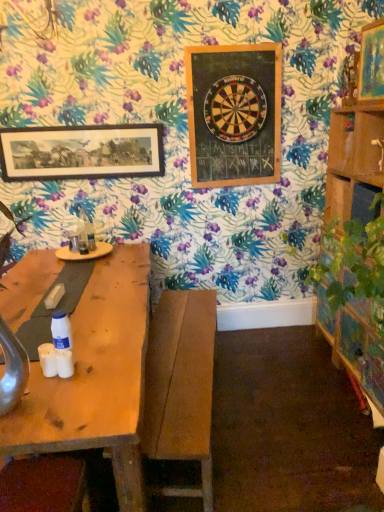
You are a GUI agent. You are given a task and a screenshot of the screen. Output one action in this format:
    pyautogui.click(x=<x>, y=<y>)
    Task: Click on the wooden picture frame at upper right, positioned as the first picture frame in front-to-back order
    This screenshot has width=384, height=512.
    Given the screenshot: What is the action you would take?
    pyautogui.click(x=372, y=62)

Can you confirm if velvet brown cushion at lower left, the first swivel chair positioned from the front, is wider than wooden dartboard at upper center, the second picture frame in the front-to-back sequence?

Indeed, velvet brown cushion at lower left, the first swivel chair positioned from the front, has a greater width compared to wooden dartboard at upper center, the second picture frame in the front-to-back sequence.

In the scene shown: Is velvet brown cushion at lower left, which appears as the first swivel chair when viewed from the left, positioned with its back to wooden dartboard at upper center, positioned as the second picture frame in back-to-front order?

No, wooden dartboard at upper center, positioned as the second picture frame in back-to-front order, is not at the back of velvet brown cushion at lower left, which appears as the first swivel chair when viewed from the left.

There is a velvet brown cushion at lower left, which appears as the first swivel chair when viewed from the left. Where is `the 2nd picture frame above it (from a real-world perspective)`? the 2nd picture frame above it (from a real-world perspective) is located at coordinates (234, 114).

Consider the image. Is the depth of velvet brown cushion at lower left, placed as the 2th swivel chair when sorted from right to left, greater than that of wooden dartboard at upper center, the second picture frame in the front-to-back sequence?

No, velvet brown cushion at lower left, placed as the 2th swivel chair when sorted from right to left, is in front of wooden dartboard at upper center, the second picture frame in the front-to-back sequence.

From a real-world perspective, which picture frame is the 3rd one above the velvet brown cushion at lower left, the first swivel chair positioned from the front? Please provide its 2D coordinates.

[(372, 62)]

From the picture: Considering the sizes of objects velvet brown cushion at lower left, placed as the 2th swivel chair when sorted from right to left, and wooden picture frame at upper right, positioned as the first picture frame in front-to-back order, in the image provided, who is shorter, velvet brown cushion at lower left, placed as the 2th swivel chair when sorted from right to left, or wooden picture frame at upper right, positioned as the first picture frame in front-to-back order,?

velvet brown cushion at lower left, placed as the 2th swivel chair when sorted from right to left.

Is velvet brown cushion at lower left, which ranks as the 2th swivel chair in back-to-front order, aimed at wooden picture frame at upper right, the 3th picture frame when ordered from back to front?

No, velvet brown cushion at lower left, which ranks as the 2th swivel chair in back-to-front order, is not turned towards wooden picture frame at upper right, the 3th picture frame when ordered from back to front.

From a real-world perspective, is wooden bench at center, the second swivel chair from the left, positioned above or below wooden framed print at upper left, the 3th picture frame when ordered from front to back?

In terms of real-world spatial position, wooden bench at center, the second swivel chair from the left, is below wooden framed print at upper left, the 3th picture frame when ordered from front to back.

Who is smaller, wooden bench at center, which is the 2th swivel chair in front-to-back order, or wooden framed print at upper left, the 3th picture frame when ordered from front to back?

wooden framed print at upper left, the 3th picture frame when ordered from front to back.

Is wooden framed print at upper left, which is the third picture frame from right to left, at the back of wooden bench at center, which is the 2th swivel chair in front-to-back order?

No, wooden bench at center, which is the 2th swivel chair in front-to-back order, is not facing the opposite direction of wooden framed print at upper left, which is the third picture frame from right to left.

What's the angular difference between wooden bench at center, placed as the first swivel chair when sorted from back to front, and wooden framed print at upper left, marked as the 1th picture frame in a back-to-front arrangement,'s facing directions?

They differ by 99.7 degrees in their facing directions.

Which object is positioned more to the left, wooden framed print at upper left, the 3th picture frame when ordered from front to back, or velvet brown cushion at lower left, the first swivel chair positioned from the front?

wooden framed print at upper left, the 3th picture frame when ordered from front to back.

Which of these two, wooden framed print at upper left, marked as the 1th picture frame in a back-to-front arrangement, or velvet brown cushion at lower left, placed as the 2th swivel chair when sorted from right to left, stands shorter?

Standing shorter between the two is velvet brown cushion at lower left, placed as the 2th swivel chair when sorted from right to left.

From the image's perspective, who appears lower, wooden framed print at upper left, marked as the 1th picture frame in a back-to-front arrangement, or velvet brown cushion at lower left, the first swivel chair positioned from the front?

velvet brown cushion at lower left, the first swivel chair positioned from the front, from the image's perspective.

I want to click on the 2nd swivel chair in front of the wooden framed print at upper left, which is the third picture frame from right to left, starting your count from the anchor, so click(x=43, y=485).

Is the position of wooden picture frame at upper right, the 3th picture frame when ordered from back to front, less distant than that of wooden framed print at upper left, the 1th picture frame when ordered from left to right?

Yes.

From a real-world perspective, which object stands above the other?

wooden picture frame at upper right, arranged as the third picture frame when viewed from the left.

Between wooden picture frame at upper right, arranged as the 1th picture frame when viewed from the right, and wooden framed print at upper left, which is the third picture frame from right to left, which one has larger size?

wooden picture frame at upper right, arranged as the 1th picture frame when viewed from the right, is bigger.

Can you confirm if wooden framed print at upper left, the 1th picture frame when ordered from left to right, is shorter than wooden bench at center, the second swivel chair from the left?

Yes.

Is wooden framed print at upper left, the 1th picture frame when ordered from left to right, facing away from wooden bench at center, placed as the first swivel chair when sorted from back to front?

No, wooden bench at center, placed as the first swivel chair when sorted from back to front, is not at the back of wooden framed print at upper left, the 1th picture frame when ordered from left to right.

How different are the orientations of wooden framed print at upper left, marked as the 1th picture frame in a back-to-front arrangement, and wooden bench at center, placed as the first swivel chair when sorted from back to front, in degrees?

They differ by 99.7 degrees in their facing directions.

Considering the sizes of objects wooden framed print at upper left, the 3th picture frame when ordered from front to back, and wooden bench at center, placed as the first swivel chair when sorted from back to front, in the image provided, who is smaller, wooden framed print at upper left, the 3th picture frame when ordered from front to back, or wooden bench at center, placed as the first swivel chair when sorted from back to front,?

wooden framed print at upper left, the 3th picture frame when ordered from front to back, is smaller.

Considering the relative sizes of wooden dartboard at upper center, positioned as the second picture frame in back-to-front order, and wooden picture frame at upper right, arranged as the third picture frame when viewed from the left, in the image provided, is wooden dartboard at upper center, positioned as the second picture frame in back-to-front order, thinner than wooden picture frame at upper right, arranged as the third picture frame when viewed from the left,?

Indeed, wooden dartboard at upper center, positioned as the second picture frame in back-to-front order, has a lesser width compared to wooden picture frame at upper right, arranged as the third picture frame when viewed from the left.

From their relative heights in the image, would you say wooden dartboard at upper center, positioned as the second picture frame in back-to-front order, is taller or shorter than wooden picture frame at upper right, the 3th picture frame when ordered from back to front?

Considering their sizes, wooden dartboard at upper center, positioned as the second picture frame in back-to-front order, has more height than wooden picture frame at upper right, the 3th picture frame when ordered from back to front.

Visually, is wooden dartboard at upper center, the 2th picture frame when ordered from right to left, positioned to the left or to the right of wooden picture frame at upper right, arranged as the third picture frame when viewed from the left?

Based on their positions, wooden dartboard at upper center, the 2th picture frame when ordered from right to left, is located to the left of wooden picture frame at upper right, arranged as the third picture frame when viewed from the left.

Does wooden dartboard at upper center, positioned as the second picture frame in back-to-front order, touch wooden picture frame at upper right, the 3th picture frame when ordered from back to front?

No, wooden dartboard at upper center, positioned as the second picture frame in back-to-front order, is not with wooden picture frame at upper right, the 3th picture frame when ordered from back to front.

Where is `swivel chair that is the 1st object directly below the wooden dartboard at upper center, the second picture frame in the front-to-back sequence (from a real-world perspective)`? This screenshot has height=512, width=384. swivel chair that is the 1st object directly below the wooden dartboard at upper center, the second picture frame in the front-to-back sequence (from a real-world perspective) is located at coordinates (43, 485).

The width and height of the screenshot is (384, 512). I want to click on the 1st picture frame behind the velvet brown cushion at lower left, which ranks as the 2th swivel chair in back-to-front order, so click(372, 62).

From the picture: Which object lies nearer to the anchor point wooden bench at center, placed as the first swivel chair when sorted from back to front, velvet brown cushion at lower left, which appears as the first swivel chair when viewed from the left, or wooden dartboard at upper center, positioned as the second picture frame in back-to-front order?

velvet brown cushion at lower left, which appears as the first swivel chair when viewed from the left, is positioned closer to the anchor wooden bench at center, placed as the first swivel chair when sorted from back to front.

From the image, which object appears to be nearer to wooden framed print at upper left, the 1th picture frame when ordered from left to right, wooden bench at center, placed as the first swivel chair when sorted from back to front, or velvet brown cushion at lower left, which ranks as the 2th swivel chair in back-to-front order?

Among the two, wooden bench at center, placed as the first swivel chair when sorted from back to front, is located nearer to wooden framed print at upper left, the 1th picture frame when ordered from left to right.

Based on their spatial positions, is wooden bench at center, which is the 2th swivel chair in front-to-back order, or wooden framed print at upper left, the 1th picture frame when ordered from left to right, further from velvet brown cushion at lower left, placed as the 2th swivel chair when sorted from right to left?

wooden framed print at upper left, the 1th picture frame when ordered from left to right, is further to velvet brown cushion at lower left, placed as the 2th swivel chair when sorted from right to left.

Estimate the real-world distances between objects in this image. Which object is closer to wooden bench at center, which is the 2th swivel chair in front-to-back order, wooden framed print at upper left, which is the third picture frame from right to left, or wooden picture frame at upper right, the 3th picture frame when ordered from back to front?

The object closer to wooden bench at center, which is the 2th swivel chair in front-to-back order, is wooden framed print at upper left, which is the third picture frame from right to left.

Consider the image. Estimate the real-world distances between objects in this image. Which object is further from wooden framed print at upper left, the 3th picture frame when ordered from front to back, wooden picture frame at upper right, arranged as the 1th picture frame when viewed from the right, or wooden bench at center, placed as the first swivel chair when sorted from back to front?

wooden picture frame at upper right, arranged as the 1th picture frame when viewed from the right, is further to wooden framed print at upper left, the 3th picture frame when ordered from front to back.

Based on their spatial positions, is wooden bench at center, placed as the first swivel chair when sorted from back to front, or velvet brown cushion at lower left, placed as the 2th swivel chair when sorted from right to left, further from wooden picture frame at upper right, arranged as the 1th picture frame when viewed from the right?

Based on the image, velvet brown cushion at lower left, placed as the 2th swivel chair when sorted from right to left, appears to be further to wooden picture frame at upper right, arranged as the 1th picture frame when viewed from the right.

From the image, which object appears to be nearer to velvet brown cushion at lower left, which ranks as the 2th swivel chair in back-to-front order, wooden picture frame at upper right, arranged as the 1th picture frame when viewed from the right, or wooden dartboard at upper center, positioned as the second picture frame in back-to-front order?

wooden dartboard at upper center, positioned as the second picture frame in back-to-front order, lies closer to velvet brown cushion at lower left, which ranks as the 2th swivel chair in back-to-front order, than the other object.

Which object lies nearer to the anchor point velvet brown cushion at lower left, placed as the 2th swivel chair when sorted from right to left, wooden dartboard at upper center, positioned as the second picture frame in back-to-front order, or wooden bench at center, the second swivel chair from the left?

wooden bench at center, the second swivel chair from the left, lies closer to velvet brown cushion at lower left, placed as the 2th swivel chair when sorted from right to left, than the other object.

I want to click on swivel chair that lies between wooden dartboard at upper center, the 2th picture frame when ordered from right to left, and velvet brown cushion at lower left, the first swivel chair positioned from the front, from top to bottom, so click(181, 385).

You are a GUI agent. You are given a task and a screenshot of the screen. Output one action in this format:
    pyautogui.click(x=<x>, y=<y>)
    Task: Click on the picture frame located between wooden framed print at upper left, the 1th picture frame when ordered from left to right, and wooden picture frame at upper right, arranged as the 1th picture frame when viewed from the right, in the left-right direction
    The height and width of the screenshot is (512, 384).
    Given the screenshot: What is the action you would take?
    pyautogui.click(x=234, y=114)

Where is `swivel chair between wooden picture frame at upper right, the 3th picture frame when ordered from back to front, and velvet brown cushion at lower left, which ranks as the 2th swivel chair in back-to-front order, in the vertical direction`? The width and height of the screenshot is (384, 512). swivel chair between wooden picture frame at upper right, the 3th picture frame when ordered from back to front, and velvet brown cushion at lower left, which ranks as the 2th swivel chair in back-to-front order, in the vertical direction is located at coordinates (181, 385).

The height and width of the screenshot is (512, 384). I want to click on picture frame between wooden dartboard at upper center, positioned as the second picture frame in back-to-front order, and velvet brown cushion at lower left, the first swivel chair positioned from the front, from top to bottom, so click(81, 152).